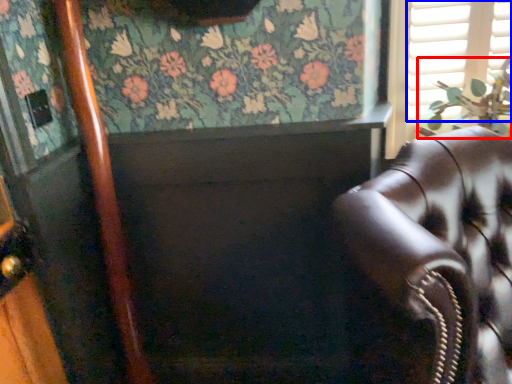
Question: Which of the following is the closest to the observer, plant (highlighted by a red box) or shutter (highlighted by a blue box)?

Choices:
 (A) plant
 (B) shutter

Answer: (A)